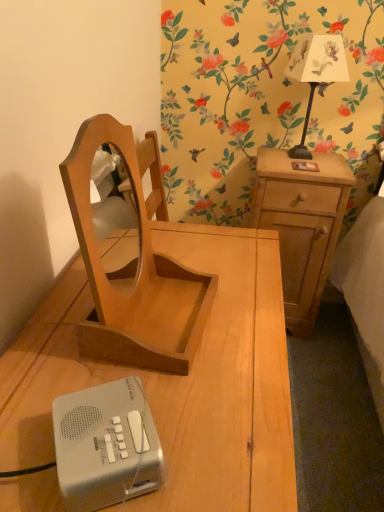
Where is `vacant space situated on the left part of light brown wood mirror at center`? This screenshot has height=512, width=384. vacant space situated on the left part of light brown wood mirror at center is located at coordinates (54, 324).